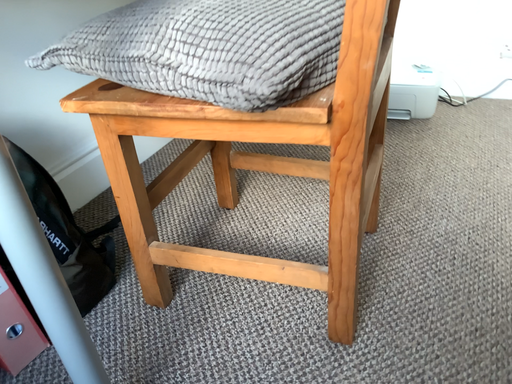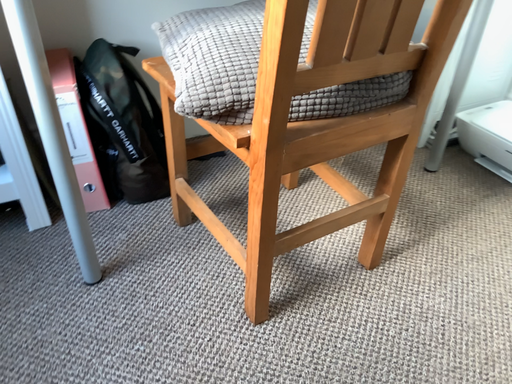
Question: Which way did the camera rotate in the video?

Choices:
 (A) rotated left
 (B) rotated right

Answer: (A)